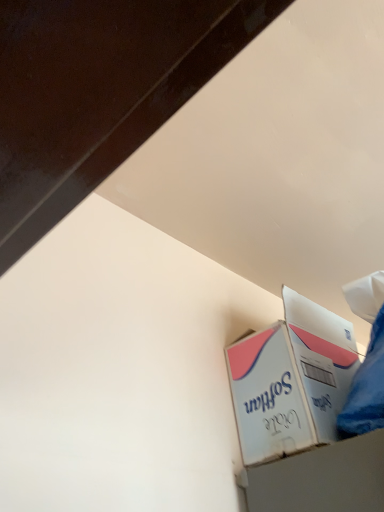
Looking at this image, measure the distance between point (312, 345) and camera.

A distance of 1.09 meters exists between point (312, 345) and camera.

What do you see at coordinates (291, 380) in the screenshot? This screenshot has height=512, width=384. I see `white cardboard box at upper right` at bounding box center [291, 380].

Image resolution: width=384 pixels, height=512 pixels. What are the coordinates of `white cardboard box at upper right` in the screenshot? It's located at (291, 380).

Find the location of a particular element. white cardboard box at upper right is located at coordinates (291, 380).